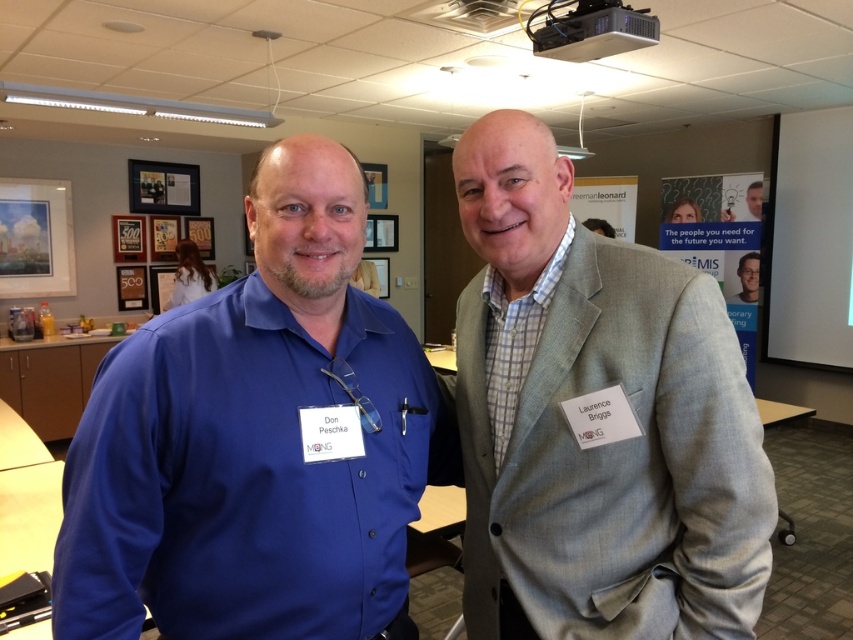
Is matte blue shirt at left positioned at the back of gray wool suit at center?

That is False.

Is matte blue shirt at left wider than gray wool suit at center?

Yes.

Does point (219, 314) come farther from viewer compared to point (552, 508)?

No, (219, 314) is in front of (552, 508).

In order to click on matte blue shirt at left in this screenshot , I will do `click(257, 442)`.

Can you confirm if matte blue shirt at left is shorter than white matte projector screen at upper right?

Yes, matte blue shirt at left is shorter than white matte projector screen at upper right.

Which is in front, point (224, 540) or point (799, 157)?

Positioned in front is point (224, 540).

Locate an element on the screen. Image resolution: width=853 pixels, height=640 pixels. matte blue shirt at left is located at coordinates point(257,442).

Can you confirm if gray wool suit at center is positioned below white matte projector screen at upper right?

Correct, gray wool suit at center is located below white matte projector screen at upper right.

Is point (524, 301) in front of point (815, 132)?

Yes, point (524, 301) is in front of point (815, 132).

Locate an element on the screen. gray wool suit at center is located at coordinates (595, 442).